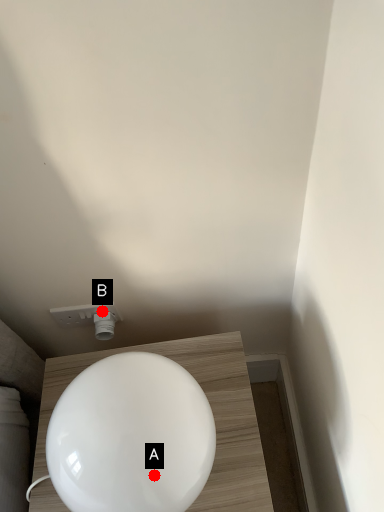
Question: Two points are circled on the image, labeled by A and B beside each circle. Which point appears closest to the camera in this image?

Choices:
 (A) A is closer
 (B) B is closer

Answer: (A)